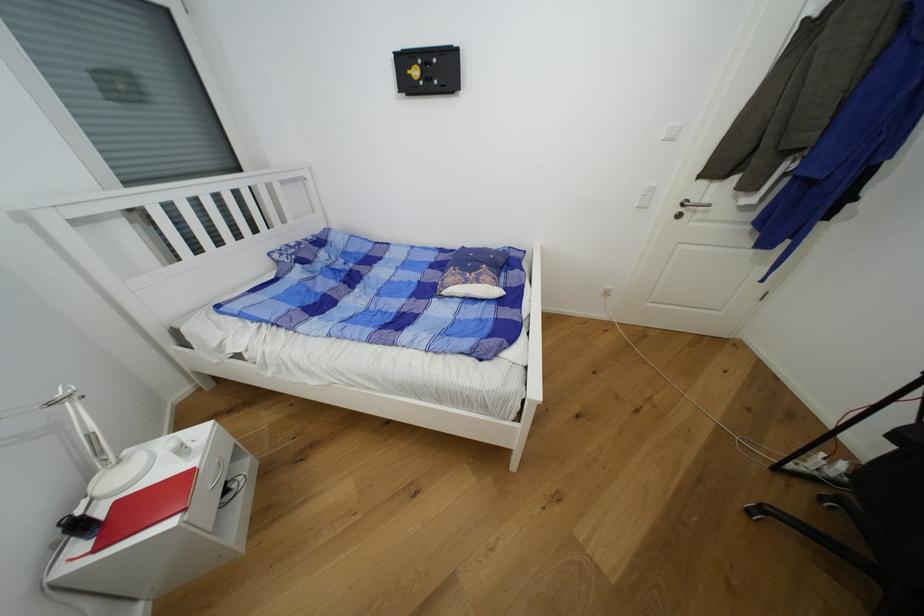
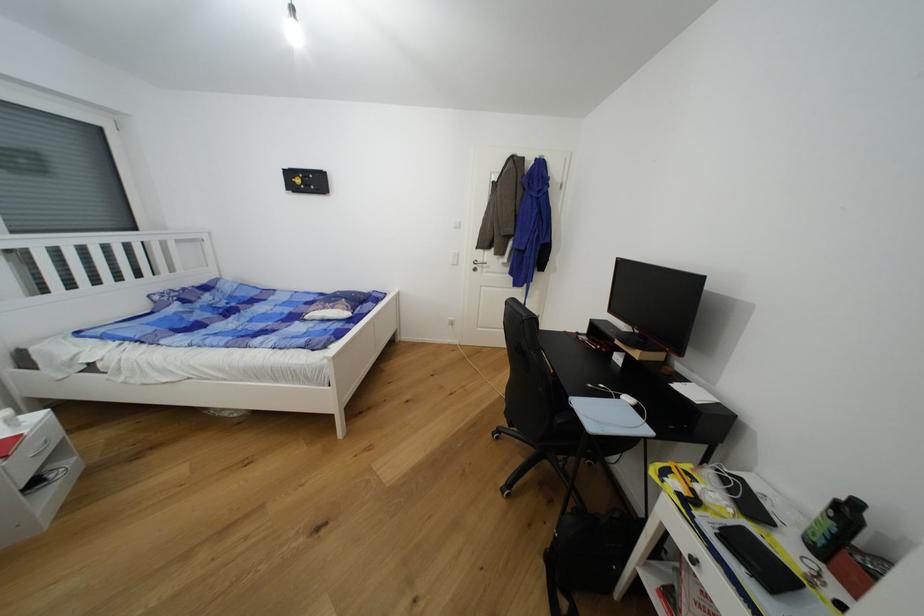
Locate, in the second image, the point that corresponds to pixel 699 203 in the first image.

(484, 262)